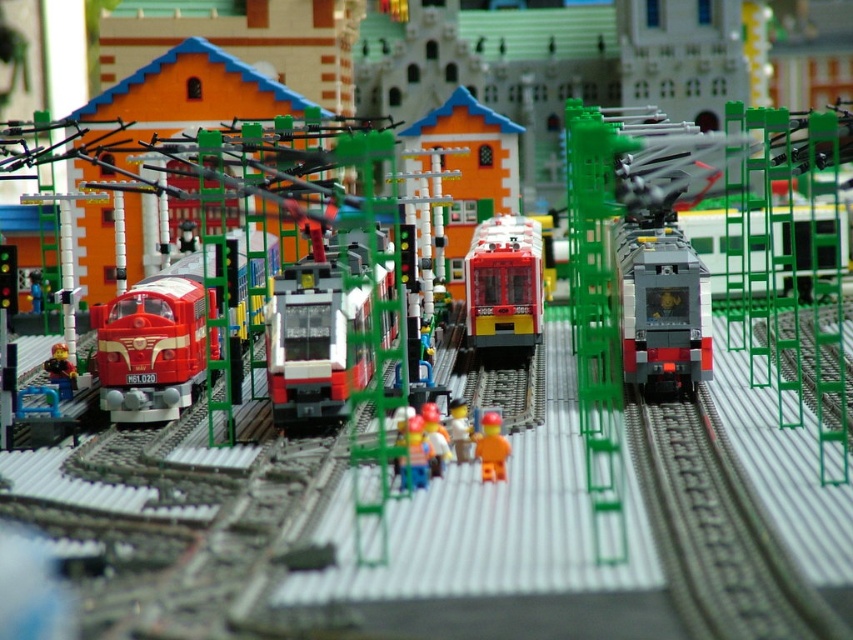
Question: Is matte red train at center to the left of translucent orange figure at center from the viewer's perspective?

Choices:
 (A) no
 (B) yes

Answer: (A)

Question: Can you confirm if smooth plastic toy at center is positioned below matte black figure at lower left?

Choices:
 (A) yes
 (B) no

Answer: (A)

Question: Is translucent orange figure at center above matte black figure at lower left?

Choices:
 (A) yes
 (B) no

Answer: (B)

Question: Which object is closer to the camera taking this photo?

Choices:
 (A) matte red train at left
 (B) smooth orange figure at center

Answer: (B)

Question: Considering the real-world distances, which object is closest to the translucent orange figure at center?

Choices:
 (A) matte red train at center
 (B) shiny red train at center

Answer: (B)

Question: Which object is closer to the camera taking this photo?

Choices:
 (A) orange matte figure at center
 (B) matte red train at left
 (C) matte red train at center

Answer: (A)